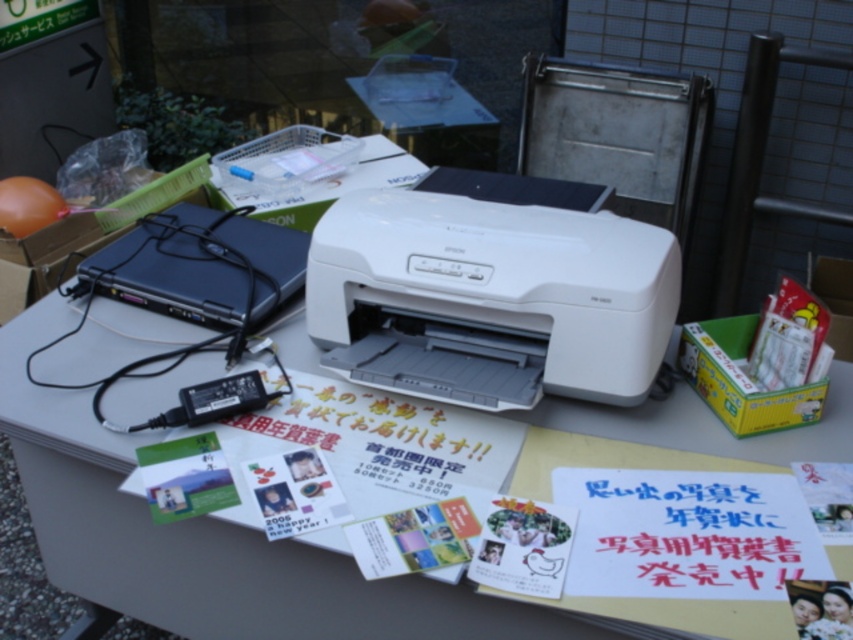
Which is above, black plastic laptop at left or matte paper postcard at center?

black plastic laptop at left

Looking at this image, does black plastic laptop at left come behind matte paper postcard at center?

Yes, black plastic laptop at left is further from the viewer.

Image resolution: width=853 pixels, height=640 pixels. In order to click on black plastic laptop at left in this screenshot , I will do `click(200, 266)`.

Identify the location of black plastic laptop at left. This screenshot has width=853, height=640. (200, 266).

Is white plastic printer at center thinner than black plastic laptop at left?

Incorrect, white plastic printer at center's width is not less than black plastic laptop at left's.

Between point (349, 248) and point (186, 307), which one is positioned in front?

Point (349, 248) is in front.

Locate an element on the screen. The height and width of the screenshot is (640, 853). white plastic printer at center is located at coordinates (489, 298).

Is black plastic laptop at left behind green matte postcard at center?

Yes, black plastic laptop at left is further from the viewer.

Between point (96, 280) and point (143, 456), which one is positioned behind?

The point (96, 280) is behind.

Which is in front, point (250, 262) or point (178, 488)?

Point (178, 488)

Locate an element on the screen. black plastic laptop at left is located at coordinates (200, 266).